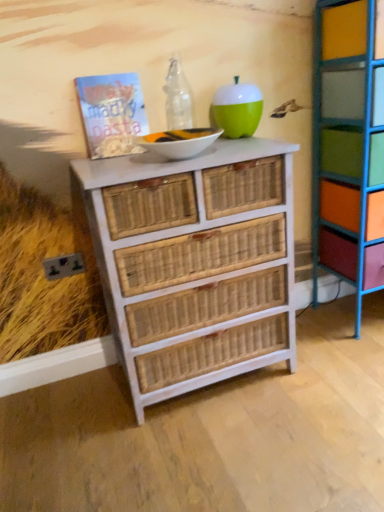
The height and width of the screenshot is (512, 384). What do you see at coordinates (112, 114) in the screenshot? I see `matte paper book at upper left` at bounding box center [112, 114].

Identify the location of matte paper book at upper left. This screenshot has height=512, width=384. (112, 114).

This screenshot has width=384, height=512. Describe the element at coordinates (194, 262) in the screenshot. I see `white wicker chest of drawers at center` at that location.

The image size is (384, 512). In order to click on matte paper book at upper left in this screenshot , I will do `click(112, 114)`.

Can you confirm if matte paper book at upper left is shorter than multicolored painted wood shelf at right?

Yes, matte paper book at upper left is shorter than multicolored painted wood shelf at right.

What are the coordinates of `shelf that is in front of the matte paper book at upper left` in the screenshot? It's located at (348, 146).

Does point (118, 103) lie behind point (340, 165)?

No, it is not.

Does multicolored painted wood shelf at right have a greater width compared to green matte apple at upper center?

Correct, the width of multicolored painted wood shelf at right exceeds that of green matte apple at upper center.

Considering the sizes of objects multicolored painted wood shelf at right and green matte apple at upper center in the image provided, who is bigger, multicolored painted wood shelf at right or green matte apple at upper center?

Bigger between the two is multicolored painted wood shelf at right.

Is multicolored painted wood shelf at right completely or partially outside of green matte apple at upper center?

Yes, multicolored painted wood shelf at right is not within green matte apple at upper center.

From a real-world perspective, is multicolored painted wood shelf at right positioned over green matte apple at upper center based on gravity?

No, from a real-world perspective, multicolored painted wood shelf at right is not above green matte apple at upper center.

Between matte paper book at upper left and white wicker chest of drawers at center, which one appears on the right side from the viewer's perspective?

white wicker chest of drawers at center.

Is matte paper book at upper left behind white wicker chest of drawers at center?

Yes, matte paper book at upper left is further from the viewer.

Can you tell me how much matte paper book at upper left and white wicker chest of drawers at center differ in facing direction?

The angular difference between matte paper book at upper left and white wicker chest of drawers at center is 0.0715 degrees.

Looking at this image, considering the sizes of matte paper book at upper left and white wicker chest of drawers at center in the image, is matte paper book at upper left bigger or smaller than white wicker chest of drawers at center?

In the image, matte paper book at upper left appears to be smaller than white wicker chest of drawers at center.

In terms of width, does green matte apple at upper center look wider or thinner when compared to white wicker chest of drawers at center?

Clearly, green matte apple at upper center has less width compared to white wicker chest of drawers at center.

In the image, is green matte apple at upper center positioned in front of or behind white wicker chest of drawers at center?

green matte apple at upper center is behind white wicker chest of drawers at center.

From the image's perspective, who appears lower, green matte apple at upper center or white wicker chest of drawers at center?

white wicker chest of drawers at center is shown below in the image.

Looking at their sizes, would you say white wicker chest of drawers at center is wider or thinner than multicolored painted wood shelf at right?

white wicker chest of drawers at center is wider than multicolored painted wood shelf at right.

Could you tell me if white wicker chest of drawers at center is turned towards multicolored painted wood shelf at right?

No, white wicker chest of drawers at center is not facing towards multicolored painted wood shelf at right.

Is white wicker chest of drawers at center with multicolored painted wood shelf at right?

No, white wicker chest of drawers at center is not beside multicolored painted wood shelf at right.

Does multicolored painted wood shelf at right come behind matte paper book at upper left?

No, multicolored painted wood shelf at right is in front of matte paper book at upper left.

Is matte paper book at upper left surrounded by multicolored painted wood shelf at right?

No, multicolored painted wood shelf at right does not contain matte paper book at upper left.

Considering the sizes of multicolored painted wood shelf at right and matte paper book at upper left in the image, is multicolored painted wood shelf at right taller or shorter than matte paper book at upper left?

Considering their sizes, multicolored painted wood shelf at right has more height than matte paper book at upper left.

Which is in front, point (238, 113) or point (118, 90)?

The point (118, 90) is more forward.

Is green matte apple at upper center oriented towards matte paper book at upper left?

No, green matte apple at upper center is not oriented towards matte paper book at upper left.

Is green matte apple at upper center taller or shorter than matte paper book at upper left?

Considering their sizes, green matte apple at upper center has less height than matte paper book at upper left.

Between green matte apple at upper center and matte paper book at upper left, which one has larger size?

green matte apple at upper center.

Where is `shelf that appears below the matte paper book at upper left (from the image's perspective)`? This screenshot has height=512, width=384. shelf that appears below the matte paper book at upper left (from the image's perspective) is located at coordinates (348, 146).

Image resolution: width=384 pixels, height=512 pixels. What are the coordinates of `shelf on the right of green matte apple at upper center` in the screenshot? It's located at (348, 146).

Estimate the real-world distances between objects in this image. Which object is closer to green matte apple at upper center, multicolored painted wood shelf at right or white wicker chest of drawers at center?

Based on the image, multicolored painted wood shelf at right appears to be nearer to green matte apple at upper center.

Based on their spatial positions, is white wicker chest of drawers at center or multicolored painted wood shelf at right closer to green matte apple at upper center?

multicolored painted wood shelf at right.

From the image, which object appears to be farther from multicolored painted wood shelf at right, white wicker chest of drawers at center or green matte apple at upper center?

white wicker chest of drawers at center is positioned further to the anchor multicolored painted wood shelf at right.

Estimate the real-world distances between objects in this image. Which object is further from green matte apple at upper center, multicolored painted wood shelf at right or matte paper book at upper left?

multicolored painted wood shelf at right lies further to green matte apple at upper center than the other object.

Considering their positions, is green matte apple at upper center positioned further to matte paper book at upper left than white wicker chest of drawers at center?

The object further to matte paper book at upper left is white wicker chest of drawers at center.

Based on their spatial positions, is multicolored painted wood shelf at right or white wicker chest of drawers at center further from matte paper book at upper left?

multicolored painted wood shelf at right lies further to matte paper book at upper left than the other object.

Looking at the image, which one is located further to white wicker chest of drawers at center, green matte apple at upper center or matte paper book at upper left?

green matte apple at upper center.

Looking at the image, which one is located further to green matte apple at upper center, matte paper book at upper left or multicolored painted wood shelf at right?

multicolored painted wood shelf at right lies further to green matte apple at upper center than the other object.

Find the location of a particular element. The height and width of the screenshot is (512, 384). turquoise between matte paper book at upper left and multicolored painted wood shelf at right is located at coordinates (236, 109).

The image size is (384, 512). I want to click on chest of drawers between matte paper book at upper left and multicolored painted wood shelf at right in the horizontal direction, so click(194, 262).

Image resolution: width=384 pixels, height=512 pixels. Identify the location of book that lies between green matte apple at upper center and white wicker chest of drawers at center from top to bottom. (112, 114).

This screenshot has height=512, width=384. I want to click on turquoise between white wicker chest of drawers at center and multicolored painted wood shelf at right, so click(x=236, y=109).